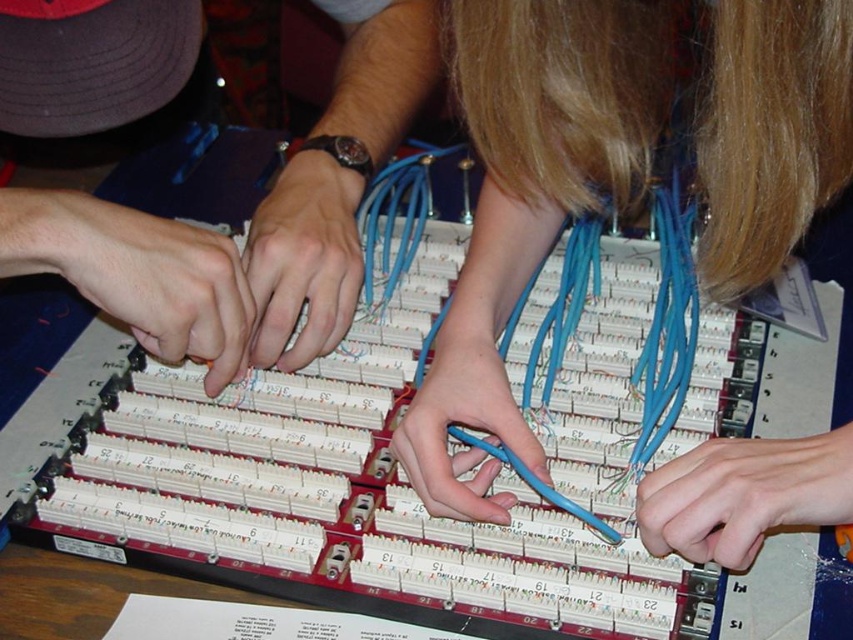
Is blue plastic hand at lower right smaller than matte black hand at center?

Yes.

Who is shorter, blue plastic hand at lower right or matte black hand at center?

blue plastic hand at lower right is shorter.

Locate an element on the screen. blue plastic hand at lower right is located at coordinates (744, 496).

In the scene shown: Can you confirm if blue rubber gloves at center is bigger than blue plastic hand at lower right?

Yes.

Based on the photo, is blue rubber gloves at center thinner than blue plastic hand at lower right?

No, blue rubber gloves at center is not thinner than blue plastic hand at lower right.

This screenshot has width=853, height=640. Find the location of `blue rubber gloves at center`. blue rubber gloves at center is located at coordinates (531, 202).

Does matte black hand at center have a greater height compared to blue rubber band at center?

No, matte black hand at center is not taller than blue rubber band at center.

Between matte black hand at center and blue rubber band at center, which one appears on the left side from the viewer's perspective?

matte black hand at center

Is point (248, 262) closer to viewer compared to point (517, 449)?

No, it is behind (517, 449).

At what (x,y) coordinates should I click in order to perform the action: click on matte black hand at center. Please return your answer as a coordinate pair (x, y). The width and height of the screenshot is (853, 640). Looking at the image, I should click on (303, 260).